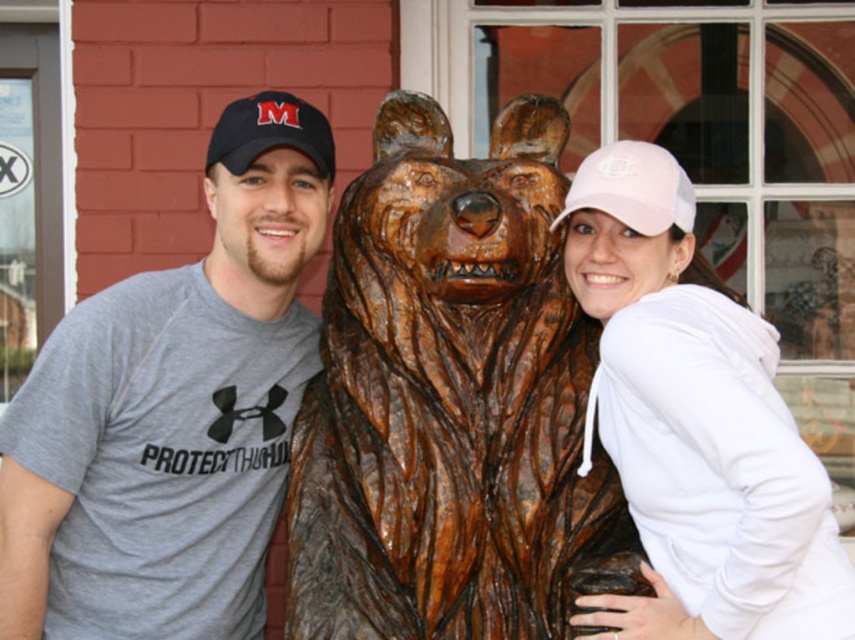
Question: Can you confirm if gray fabric t-shirt at center is wider than pink mesh baseball cap at upper right?

Choices:
 (A) yes
 (B) no

Answer: (A)

Question: Is pink mesh cap at center smaller than pink mesh baseball cap at upper right?

Choices:
 (A) yes
 (B) no

Answer: (B)

Question: Is pink mesh cap at center smaller than pink mesh baseball cap at upper right?

Choices:
 (A) no
 (B) yes

Answer: (A)

Question: Among these objects, which one is farthest from the camera?

Choices:
 (A) gray fabric t-shirt at center
 (B) black fabric cap at left

Answer: (B)

Question: Which of these objects is positioned closest to the wooden bear at center?

Choices:
 (A) pink mesh baseball cap at upper right
 (B) pink mesh cap at center
 (C) gray fabric t-shirt at center

Answer: (B)

Question: Which object appears farthest from the camera in this image?

Choices:
 (A) wooden bear at center
 (B) pink mesh baseball cap at upper right
 (C) black fabric cap at left
 (D) pink mesh cap at center

Answer: (C)